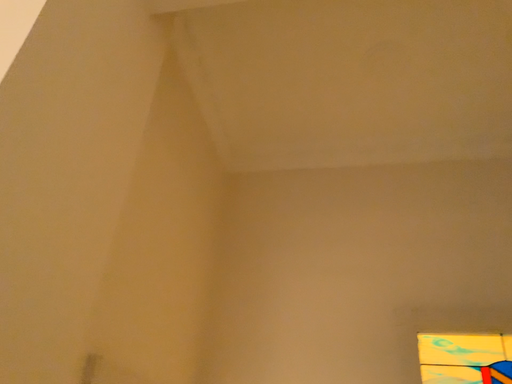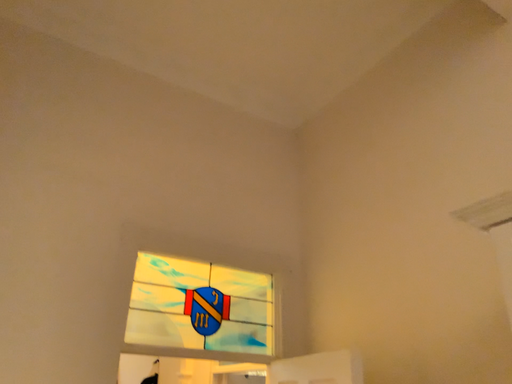
Question: How did the camera likely rotate when shooting the video?

Choices:
 (A) rotated left
 (B) rotated right

Answer: (B)